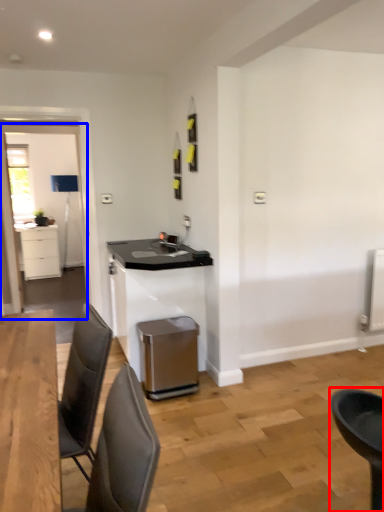
Question: Which of the following is the closest to the observer, chair (highlighted by a red box) or glass door (highlighted by a blue box)?

Choices:
 (A) chair
 (B) glass door

Answer: (A)